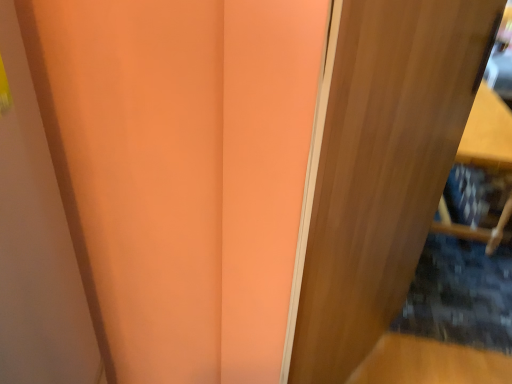
Question: Should I look upward or downward to see wooden door at right?

Choices:
 (A) up
 (B) down

Answer: (B)

Question: Can you confirm if wooden shelf at right is positioned to the left of wooden door at right?

Choices:
 (A) yes
 (B) no

Answer: (B)

Question: Does wooden shelf at right come in front of wooden door at right?

Choices:
 (A) no
 (B) yes

Answer: (A)

Question: Does wooden shelf at right have a greater height compared to wooden door at right?

Choices:
 (A) no
 (B) yes

Answer: (A)

Question: Is wooden shelf at right wider than wooden door at right?

Choices:
 (A) yes
 (B) no

Answer: (A)

Question: Is wooden shelf at right turned away from wooden door at right?

Choices:
 (A) no
 (B) yes

Answer: (A)

Question: From a real-world perspective, is wooden shelf at right located higher than wooden door at right?

Choices:
 (A) no
 (B) yes

Answer: (A)

Question: Is wooden door at right wider than wooden shelf at right?

Choices:
 (A) no
 (B) yes

Answer: (A)

Question: Could you tell me if wooden door at right is turned towards wooden shelf at right?

Choices:
 (A) yes
 (B) no

Answer: (B)

Question: Is wooden door at right looking in the opposite direction of wooden shelf at right?

Choices:
 (A) yes
 (B) no

Answer: (B)

Question: Does wooden door at right have a smaller size compared to wooden shelf at right?

Choices:
 (A) no
 (B) yes

Answer: (B)

Question: Is wooden door at right in front of wooden shelf at right?

Choices:
 (A) yes
 (B) no

Answer: (A)

Question: Can you confirm if wooden door at right is positioned to the left of wooden shelf at right?

Choices:
 (A) no
 (B) yes

Answer: (B)

Question: In terms of size, does wooden door at right appear bigger or smaller than wooden shelf at right?

Choices:
 (A) big
 (B) small

Answer: (B)